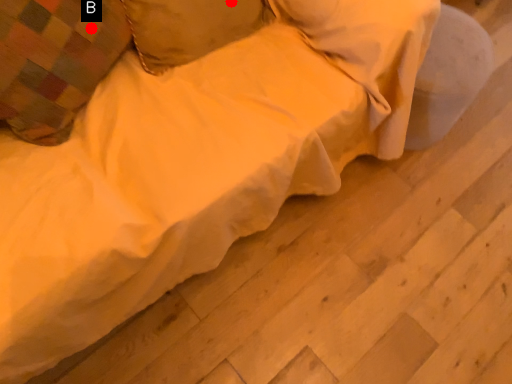
Question: Two points are circled on the image, labeled by A and B beside each circle. Which point is closer to the camera?

Choices:
 (A) A is closer
 (B) B is closer

Answer: (B)